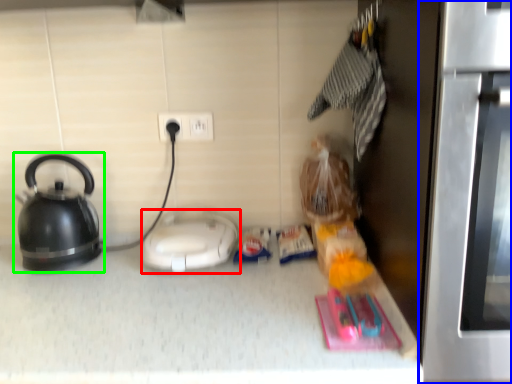
Question: Which object is the farthest from appliance (highlighted by a red box)? Choose among these: oven (highlighted by a blue box) or kettle (highlighted by a green box).

Choices:
 (A) oven
 (B) kettle

Answer: (A)